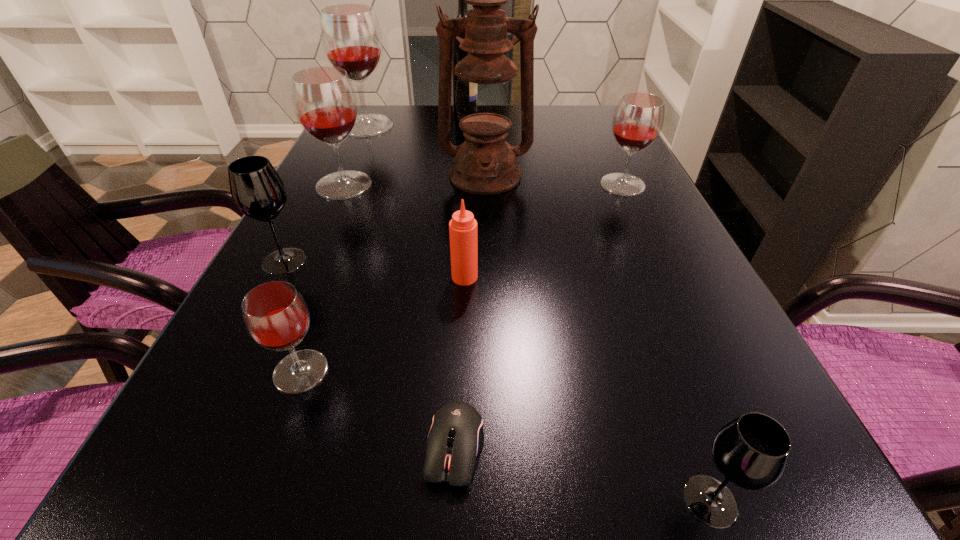
This screenshot has height=540, width=960. Find the location of `wine bottle`. wine bottle is located at coordinates (458, 54).

At what (x,y) coordinates should I click in order to perform the action: click on oil lamp. Please return your answer as a coordinate pair (x, y). Looking at the image, I should click on (485, 98).

The image size is (960, 540). I want to click on the biggest red wineglass, so click(350, 34).

At what (x,y) coordinates should I click in order to perform the action: click on the farthest wineglass. Please return your answer as a coordinate pair (x, y). This screenshot has height=540, width=960. Looking at the image, I should click on (350, 34).

Locate an element on the screen. Image resolution: width=960 pixels, height=540 pixels. the second tallest wineglass is located at coordinates click(324, 100).

Locate an element on the screen. The image size is (960, 540). the second biggest red wineglass is located at coordinates tap(324, 100).

The height and width of the screenshot is (540, 960). What are the coordinates of `the left gray wineglass` in the screenshot? It's located at point(257,190).

Find the location of a particular element. This screenshot has height=540, width=960. the third nearest wineglass is located at coordinates (257, 190).

Identify the location of the second smallest red wineglass. The height and width of the screenshot is (540, 960). (638, 119).

In order to click on Tabasco sauce in this screenshot , I will do `click(463, 234)`.